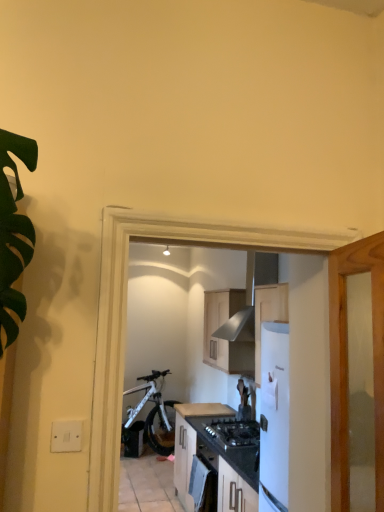
Where is `white matte bicycle at center`? This screenshot has height=512, width=384. white matte bicycle at center is located at coordinates (152, 416).

What do you see at coordinates (152, 416) in the screenshot? This screenshot has width=384, height=512. I see `white matte bicycle at center` at bounding box center [152, 416].

What is the approximate height of black matte gas stove at center?

black matte gas stove at center is 2.95 inches in height.

Measure the distance between point (195, 420) and camera.

They are 4.06 meters apart.

What do you see at coordinates (204, 479) in the screenshot? I see `satin black oven at center` at bounding box center [204, 479].

What are the coordinates of `wooden cabinet at center, marked as the first cabinetry in a top-to-bottom arrangement` in the screenshot? It's located at (224, 336).

In the scene shown: Would you say white matte cabinet at center, the first cabinetry in the bottom-to-top sequence, is inside or outside matte brown countertop at center?

The correct answer is: outside.

Which of these two, white matte cabinet at center, the second cabinetry in the top-to-bottom sequence, or matte brown countertop at center, is thinner?

matte brown countertop at center.

In the scene shown: Could you tell me if white matte cabinet at center, the first cabinetry in the bottom-to-top sequence, is turned towards matte brown countertop at center?

No, white matte cabinet at center, the first cabinetry in the bottom-to-top sequence, is not turned towards matte brown countertop at center.

Would you say white matte bicycle at center is part of matte brown countertop at center's contents?

No, matte brown countertop at center does not contain white matte bicycle at center.

Looking at this image, from a real-world perspective, relative to white matte bicycle at center, is matte brown countertop at center vertically above or below?

matte brown countertop at center is situated higher than white matte bicycle at center in the real world.

Consider the image. Is matte brown countertop at center at the right side of white matte bicycle at center?

Correct, you'll find matte brown countertop at center to the right of white matte bicycle at center.

Is point (205, 405) farther from viewer compared to point (154, 410)?

No.

Which is correct: white matte bicycle at center is inside white matte cabinet at center, the second cabinetry in the top-to-bottom sequence, or outside of it?

white matte bicycle at center exists outside the volume of white matte cabinet at center, the second cabinetry in the top-to-bottom sequence.

Is white matte bicycle at center to the left or to the right of white matte cabinet at center, the first cabinetry in the bottom-to-top sequence, in the image?

white matte bicycle at center is positioned on white matte cabinet at center, the first cabinetry in the bottom-to-top sequence,'s left side.

From the picture: How much distance is there between white matte bicycle at center and white matte cabinet at center, the second cabinetry in the top-to-bottom sequence?

white matte bicycle at center is 1.80 meters from white matte cabinet at center, the second cabinetry in the top-to-bottom sequence.

Is wooden cabinet at center, marked as the first cabinetry in a top-to-bottom arrangement, located outside black matte gas stove at center?

Indeed, wooden cabinet at center, marked as the first cabinetry in a top-to-bottom arrangement, is completely outside black matte gas stove at center.

Is wooden cabinet at center, arranged as the 2th cabinetry when ordered from the bottom, far away from black matte gas stove at center?

Actually, wooden cabinet at center, arranged as the 2th cabinetry when ordered from the bottom, and black matte gas stove at center are a little close together.

From a real-world perspective, is wooden cabinet at center, arranged as the 2th cabinetry when ordered from the bottom, physically located above or below black matte gas stove at center?

From a real-world perspective, wooden cabinet at center, arranged as the 2th cabinetry when ordered from the bottom, is physically above black matte gas stove at center.

Can you tell me how much white matte cabinet at center, the second cabinetry in the top-to-bottom sequence, and wooden cabinet at center, marked as the first cabinetry in a top-to-bottom arrangement, differ in facing direction?

The angular difference between white matte cabinet at center, the second cabinetry in the top-to-bottom sequence, and wooden cabinet at center, marked as the first cabinetry in a top-to-bottom arrangement, is 1.15 degrees.

Considering the sizes of objects white matte cabinet at center, the second cabinetry in the top-to-bottom sequence, and wooden cabinet at center, arranged as the 2th cabinetry when ordered from the bottom, in the image provided, who is shorter, white matte cabinet at center, the second cabinetry in the top-to-bottom sequence, or wooden cabinet at center, arranged as the 2th cabinetry when ordered from the bottom,?

wooden cabinet at center, arranged as the 2th cabinetry when ordered from the bottom, is shorter.

Is white matte cabinet at center, the second cabinetry in the top-to-bottom sequence, not inside wooden cabinet at center, arranged as the 2th cabinetry when ordered from the bottom?

Yes.

Is white matte cabinet at center, the first cabinetry in the bottom-to-top sequence, with wooden cabinet at center, marked as the first cabinetry in a top-to-bottom arrangement?

No, white matte cabinet at center, the first cabinetry in the bottom-to-top sequence, is not touching wooden cabinet at center, marked as the first cabinetry in a top-to-bottom arrangement.

Can you confirm if satin black oven at center is wider than white matte bicycle at center?

Incorrect, the width of satin black oven at center does not surpass that of white matte bicycle at center.

Would you say satin black oven at center is a long distance from white matte bicycle at center?

satin black oven at center is far away from white matte bicycle at center.

This screenshot has height=512, width=384. In order to click on oven above the white matte bicycle at center (from the image's perspective) in this screenshot , I will do `click(204, 479)`.

Consider the image. Which is more to the right, white matte bicycle at center or matte brown countertop at center?

matte brown countertop at center is more to the right.

From a real-world perspective, between white matte bicycle at center and matte brown countertop at center, who is vertically lower?

From a 3D spatial view, white matte bicycle at center is below.

From the image's perspective, is white matte bicycle at center positioned above or below matte brown countertop at center?

white matte bicycle at center is below matte brown countertop at center.

The width and height of the screenshot is (384, 512). Identify the location of countertop above the white matte cabinet at center, the first cabinetry in the bottom-to-top sequence (from a real-world perspective). (204, 409).

Image resolution: width=384 pixels, height=512 pixels. Identify the location of bicycle behind the matte brown countertop at center. (152, 416).

From the image, which object appears to be nearer to black matte gas stove at center, satin black oven at center or white matte bicycle at center?

satin black oven at center.

Looking at the image, which one is located closer to satin black oven at center, white matte bicycle at center or wooden cabinet at center, arranged as the 2th cabinetry when ordered from the bottom?

wooden cabinet at center, arranged as the 2th cabinetry when ordered from the bottom, is positioned closer to the anchor satin black oven at center.

When comparing their distances from matte brown countertop at center, does satin black oven at center or black matte gas stove at center seem closer?

black matte gas stove at center.

Considering their positions, is black matte gas stove at center positioned closer to wooden cabinet at center, arranged as the 2th cabinetry when ordered from the bottom, than white matte cabinet at center, the second cabinetry in the top-to-bottom sequence?

black matte gas stove at center.

Based on their spatial positions, is white matte cabinet at center, the first cabinetry in the bottom-to-top sequence, or wooden cabinet at center, marked as the first cabinetry in a top-to-bottom arrangement, further from matte brown countertop at center?

The object further to matte brown countertop at center is wooden cabinet at center, marked as the first cabinetry in a top-to-bottom arrangement.

Estimate the real-world distances between objects in this image. Which object is closer to wooden cabinet at center, marked as the first cabinetry in a top-to-bottom arrangement, satin black oven at center or white matte bicycle at center?

The object closer to wooden cabinet at center, marked as the first cabinetry in a top-to-bottom arrangement, is satin black oven at center.

Based on the photo, from the image, which object appears to be farther from white matte bicycle at center, matte brown countertop at center or wooden cabinet at center, arranged as the 2th cabinetry when ordered from the bottom?

wooden cabinet at center, arranged as the 2th cabinetry when ordered from the bottom.

When comparing their distances from satin black oven at center, does white matte cabinet at center, the first cabinetry in the bottom-to-top sequence, or white matte bicycle at center seem closer?

The object closer to satin black oven at center is white matte cabinet at center, the first cabinetry in the bottom-to-top sequence.

Locate an element on the screen. This screenshot has width=384, height=512. countertop positioned between white matte cabinet at center, the second cabinetry in the top-to-bottom sequence, and white matte bicycle at center from near to far is located at coordinates (204, 409).

Identify the location of gas stove between wooden cabinet at center, marked as the first cabinetry in a top-to-bottom arrangement, and white matte cabinet at center, the second cabinetry in the top-to-bottom sequence, in the vertical direction. The height and width of the screenshot is (512, 384). (233, 432).

Identify the location of countertop between wooden cabinet at center, marked as the first cabinetry in a top-to-bottom arrangement, and white matte cabinet at center, the second cabinetry in the top-to-bottom sequence, vertically. The height and width of the screenshot is (512, 384). (204, 409).

Find the location of a particular element. The image size is (384, 512). oven between black matte gas stove at center and white matte cabinet at center, the first cabinetry in the bottom-to-top sequence, in the up-down direction is located at coordinates (204, 479).